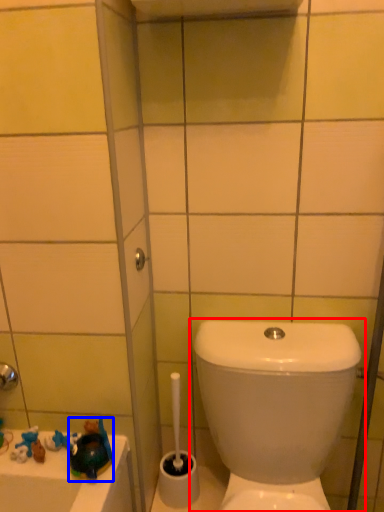
Question: Among these objects, which one is farthest to the camera, toilet (highlighted by a red box) or toy (highlighted by a blue box)?

Choices:
 (A) toilet
 (B) toy

Answer: (B)